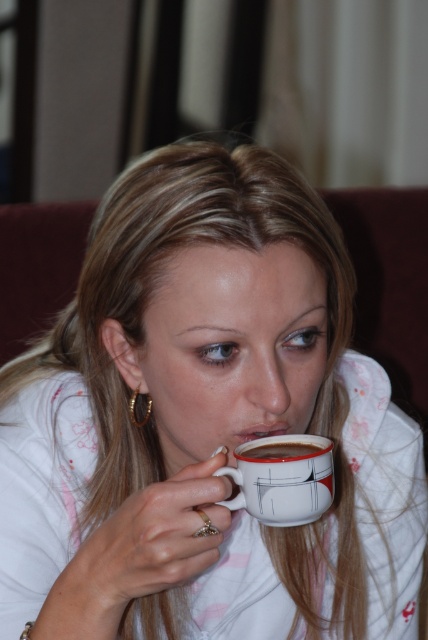
Question: Can you confirm if white glossy mug at center is smaller than white glossy mug at upper center?

Choices:
 (A) no
 (B) yes

Answer: (A)

Question: Is white glossy mug at center further to the viewer compared to white glossy mug at upper center?

Choices:
 (A) yes
 (B) no

Answer: (B)

Question: Which object appears farthest from the camera in this image?

Choices:
 (A) white glossy mug at upper center
 (B) white glossy mug at center

Answer: (A)

Question: Among these objects, which one is farthest from the camera?

Choices:
 (A) white glossy mug at upper center
 (B) white glossy mug at center

Answer: (A)

Question: Can you confirm if white glossy mug at center is positioned to the left of white glossy mug at upper center?

Choices:
 (A) yes
 (B) no

Answer: (B)